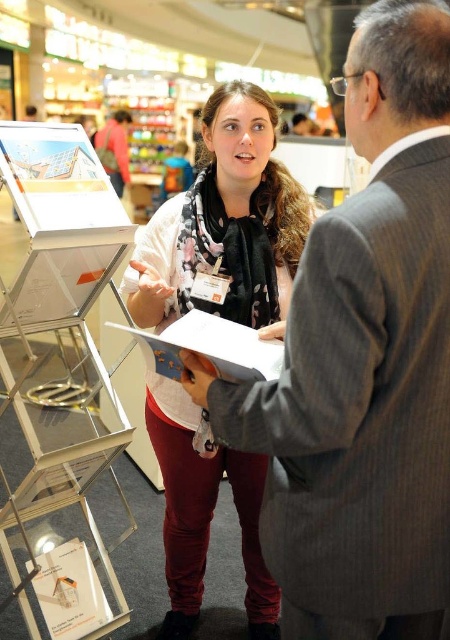
Which of these two, floral scarf at center or white paper at center, stands shorter?

With less height is white paper at center.

Which is more to the left, floral scarf at center or white paper at center?

white paper at center is more to the left.

Does point (196, 192) lie behind point (243, 346)?

Yes, it is behind point (243, 346).

Where is `floral scarf at center`? floral scarf at center is located at coordinates tap(225, 227).

The image size is (450, 640). What do you see at coordinates (364, 362) in the screenshot? I see `gray suit at center` at bounding box center [364, 362].

Can you confirm if gray suit at center is bigger than white paper at center?

Yes, gray suit at center is bigger than white paper at center.

I want to click on gray suit at center, so click(x=364, y=362).

What do you see at coordinates (364, 362) in the screenshot? I see `gray suit at center` at bounding box center [364, 362].

Does gray suit at center have a lesser width compared to floral scarf at center?

Correct, gray suit at center's width is less than floral scarf at center's.

Is point (408, 611) positioned before point (256, 625)?

Yes, it is.

Locate an element on the screen. The height and width of the screenshot is (640, 450). gray suit at center is located at coordinates (364, 362).